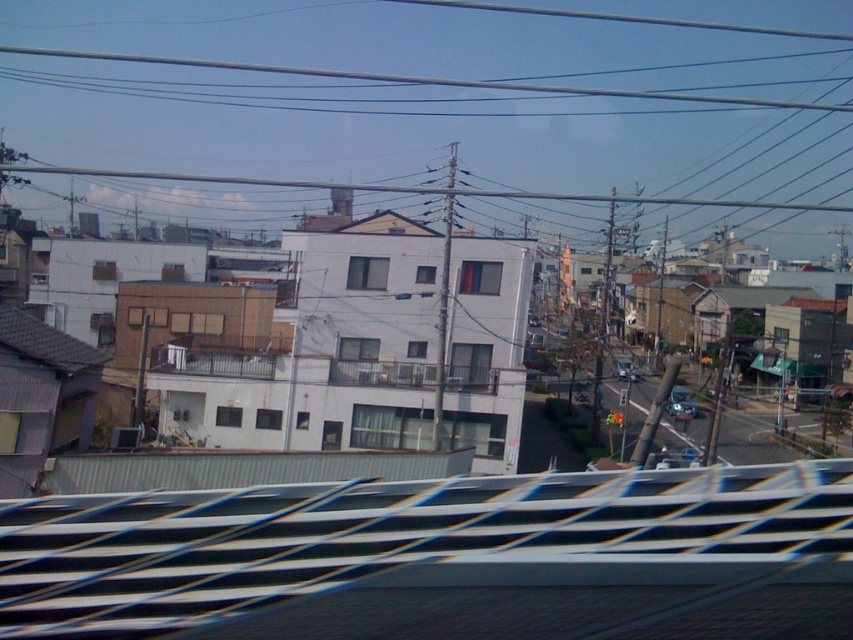
Does metallic silver train track at center lie behind metallic blue sedan at center?

No, it is not.

Between metallic silver train track at center and metallic blue sedan at center, which one has more height?

metallic blue sedan at center

Image resolution: width=853 pixels, height=640 pixels. In order to click on metallic silver train track at center in this screenshot , I will do `click(442, 557)`.

Identify the location of metallic silver train track at center. The image size is (853, 640). (442, 557).

Can you confirm if metallic wire at upper center is taller than metallic blue sedan at center?

Correct, metallic wire at upper center is much taller as metallic blue sedan at center.

Does metallic wire at upper center have a larger size compared to metallic blue sedan at center?

Yes.

Which is behind, point (265, 28) or point (618, 369)?

Positioned behind is point (265, 28).

Image resolution: width=853 pixels, height=640 pixels. I want to click on metallic wire at upper center, so click(440, 93).

Can you confirm if metallic wire at upper center is positioned to the right of metallic silver train track at center?

In fact, metallic wire at upper center is to the left of metallic silver train track at center.

Between metallic wire at upper center and metallic silver train track at center, which one appears on the left side from the viewer's perspective?

metallic wire at upper center is more to the left.

Does point (67, 93) come in front of point (669, 636)?

No, it is behind (669, 636).

Locate an element on the screen. metallic wire at upper center is located at coordinates (440, 93).